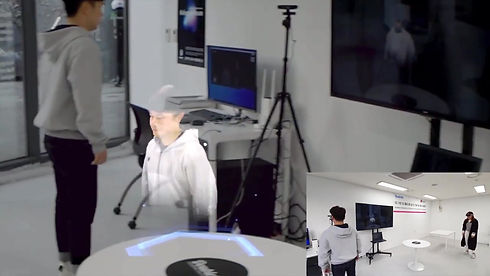
At what (x,y) coordinates should I click in order to perform the action: click on tv screen on wall. Please return your answer as a coordinate pair (x, y). This screenshot has width=490, height=276. Looking at the image, I should click on (413, 64).